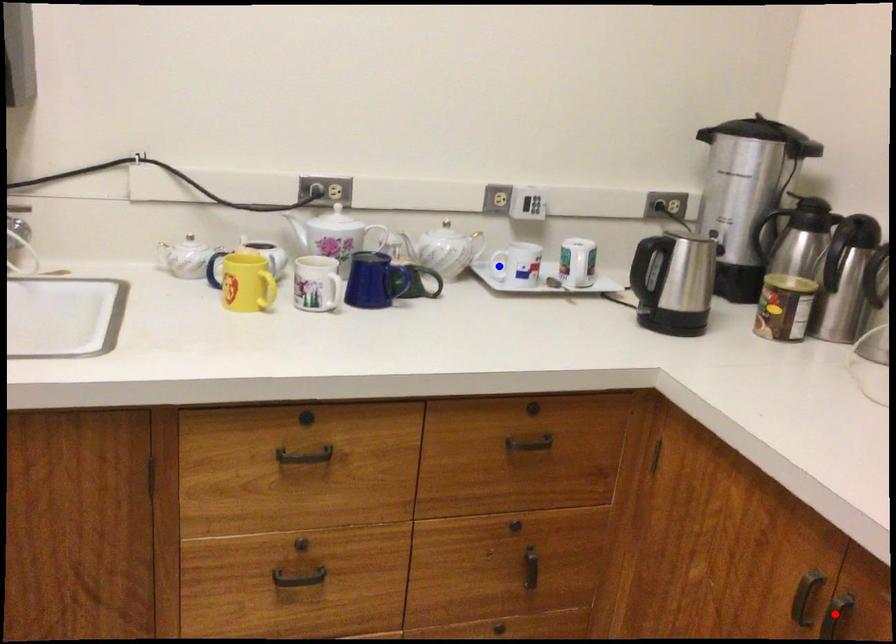
Question: Two points are marked on the image. Which point is closer to the camera?

Choices:
 (A) Blue point is closer.
 (B) Red point is closer.

Answer: (B)